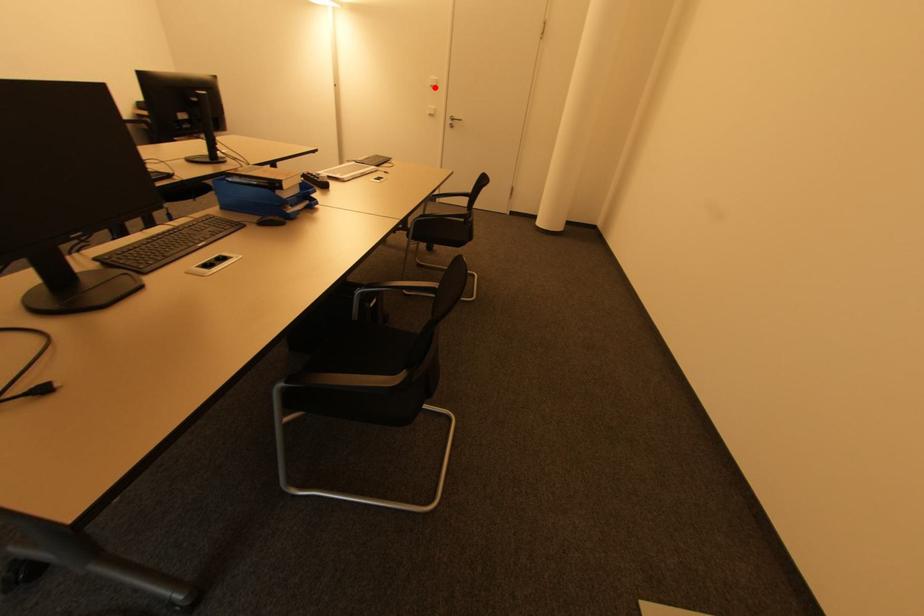
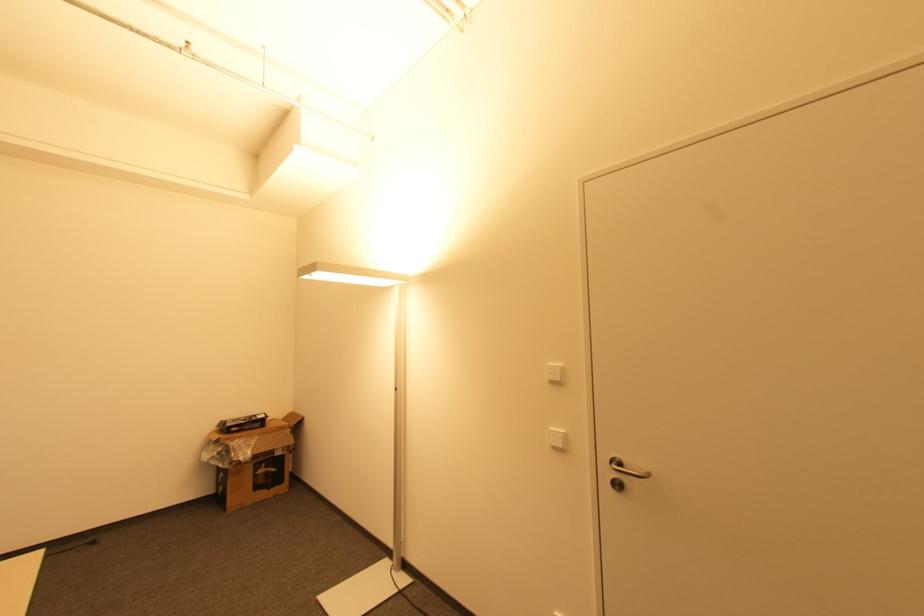
Question: I am providing you with two images of the same scene from different viewpoints. A red point is shown in image1. For the corresponding object point in image2, is it positioned nearer or farther from the camera?

Choices:
 (A) Nearer
 (B) Farther

Answer: (B)